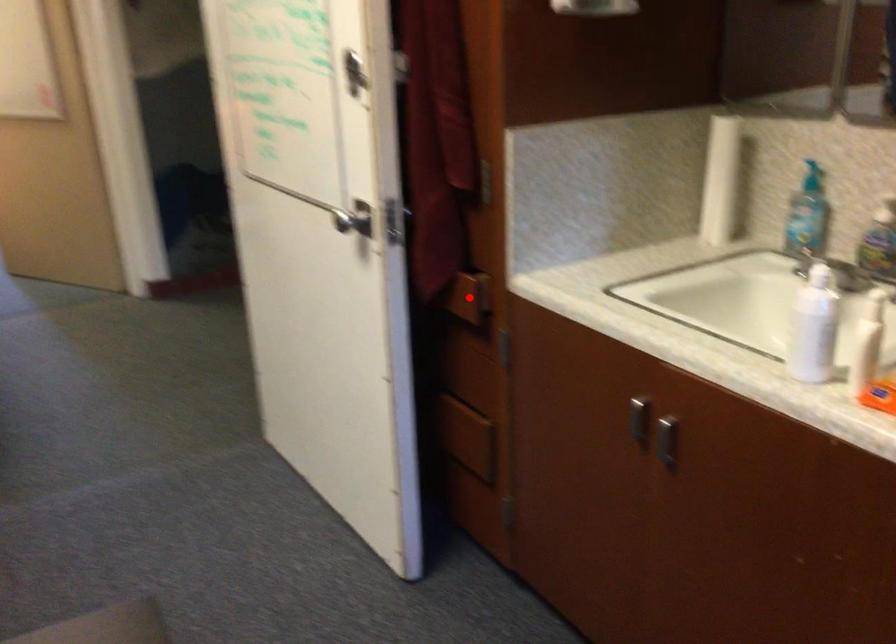
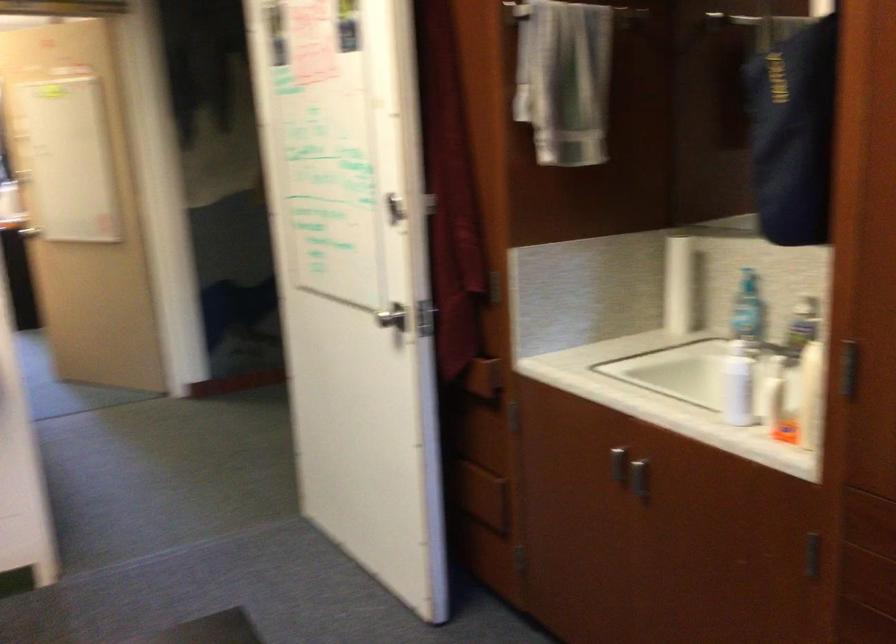
Where in the second image is the point corresponding to the highlighted location from the first image?

(485, 377)